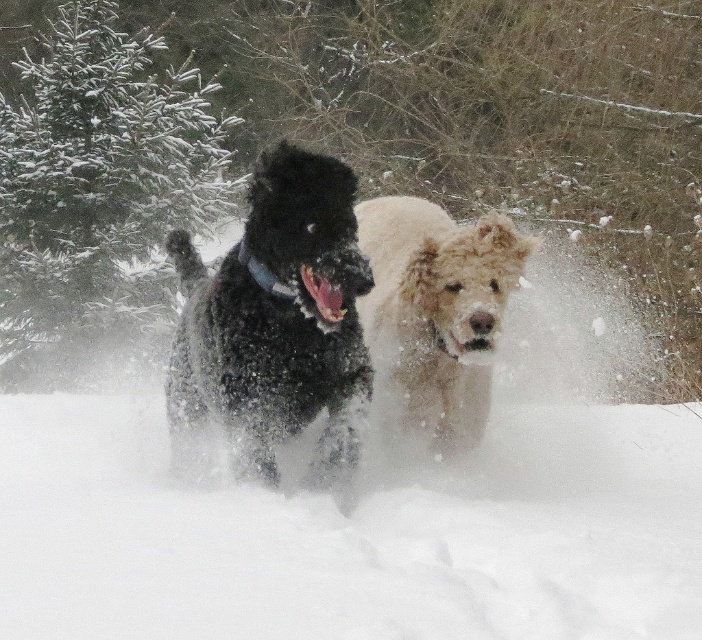
Question: Observing the image, what is the correct spatial positioning of white fluffy snow at center in reference to green textured pine at upper left?

Choices:
 (A) above
 (B) below

Answer: (B)

Question: Which of the following is the farthest from the observer?

Choices:
 (A) (37, 131)
 (B) (552, 554)

Answer: (A)

Question: Does black fluffy dog at center appear on the left side of fuzzy beige dog at center?

Choices:
 (A) yes
 (B) no

Answer: (A)

Question: Does white fluffy snow at center have a smaller size compared to green textured pine at upper left?

Choices:
 (A) no
 (B) yes

Answer: (B)

Question: Considering the real-world distances, which object is farthest from the fuzzy beige dog at center?

Choices:
 (A) black fluffy dog at center
 (B) white fluffy snow at center

Answer: (B)

Question: Which of the following is the farthest from the observer?

Choices:
 (A) (399, 500)
 (B) (86, 90)
 (C) (331, 232)

Answer: (B)